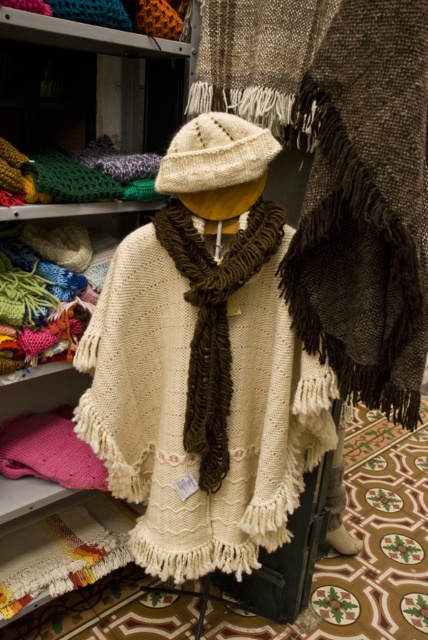
You are a customer in a craft store looking at the display. You see a white knitted poncho at center and a dark brown textured shawl at center. Which item is positioned to the left of the other?

The white knitted poncho at center is positioned to the left of the dark brown textured shawl at center.

Based on the coordinates provided, where is the white knitted poncho at center located in the image?

The white knitted poncho at center is located at the coordinates point (202,392).